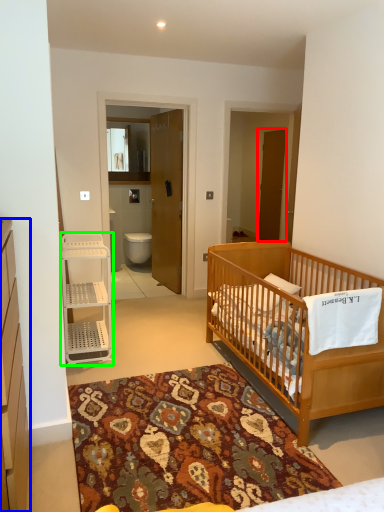
Question: Considering the real-world distances, which object is closest to screen door (highlighted by a red box)? cabinetry (highlighted by a blue box) or shelf (highlighted by a green box).

Choices:
 (A) cabinetry
 (B) shelf

Answer: (B)